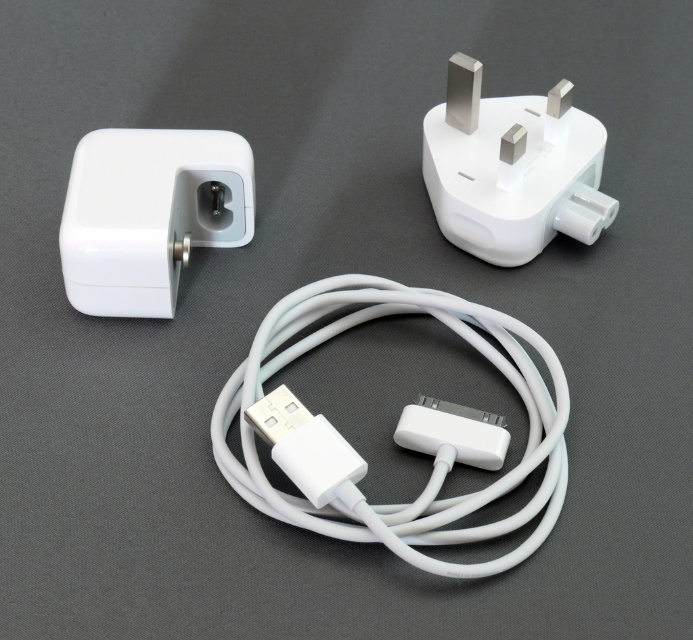
Does white matte cable at center have a larger size compared to white plastic plug at upper right?

Yes, white matte cable at center is bigger than white plastic plug at upper right.

Between white matte cable at center and white plastic plug at upper right, which one appears on the left side from the viewer's perspective?

white matte cable at center

Is point (439, 305) farther from viewer compared to point (432, 205)?

No, it is in front of (432, 205).

Where is `white matte cable at center`? white matte cable at center is located at coordinates (394, 429).

How distant is white matte power adapter at upper left from white plastic plug at upper right?

The distance of white matte power adapter at upper left from white plastic plug at upper right is 18.07 inches.

Which is behind, point (204, 154) or point (563, 211)?

Positioned behind is point (563, 211).

In order to click on white matte power adapter at upper left in this screenshot , I will do `click(149, 212)`.

Is white matte cable at center above white matte power adapter at upper left?

No.

Describe the element at coordinates (394, 429) in the screenshot. The width and height of the screenshot is (693, 640). I see `white matte cable at center` at that location.

Between point (240, 481) and point (228, 161), which one is positioned in front?

Point (240, 481)

Identify the location of white matte cable at center. Image resolution: width=693 pixels, height=640 pixels. (394, 429).